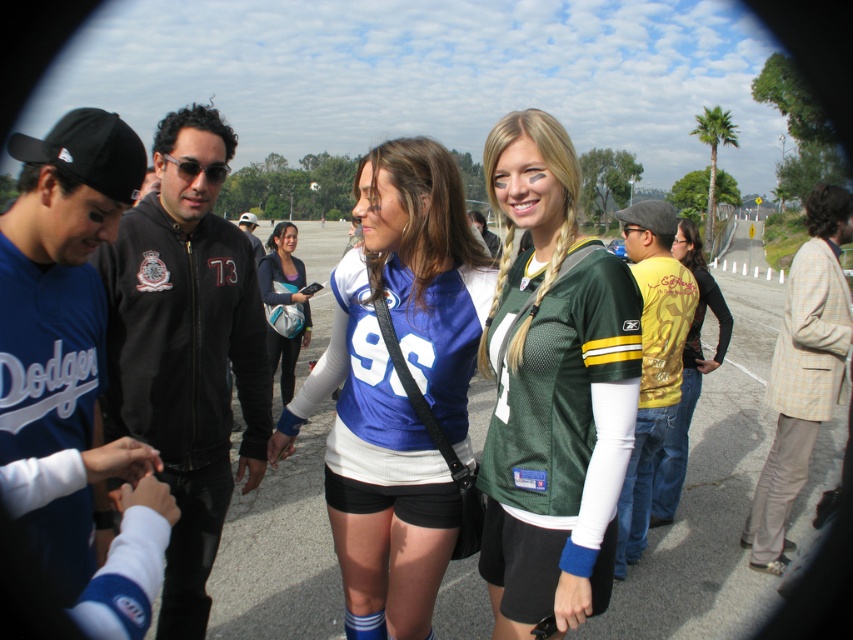
Who is higher up, white jersey at center or black zip-up jacket at left?

white jersey at center is above.

Is point (683, 579) farther from camera compared to point (184, 284)?

Yes.

Where is `white jersey at center`? This screenshot has height=640, width=853. white jersey at center is located at coordinates (711, 499).

Does green jersey at right have a smaller size compared to blue jersey at center?

Correct, green jersey at right occupies less space than blue jersey at center.

Is point (811, 321) positioned before point (282, 257)?

Yes, it is in front of point (282, 257).

You are a GUI agent. You are given a task and a screenshot of the screen. Output one action in this format:
    pyautogui.click(x=<x>, y=<y>)
    Task: Click on the green jersey at right
    
    Given the screenshot: What is the action you would take?
    pyautogui.click(x=802, y=371)

Does green jersey at center have a smaller size compared to green jersey at right?

Yes, green jersey at center is smaller than green jersey at right.

Is green jersey at center taller than green jersey at right?

In fact, green jersey at center may be shorter than green jersey at right.

The width and height of the screenshot is (853, 640). In order to click on green jersey at center in this screenshot , I will do `click(552, 388)`.